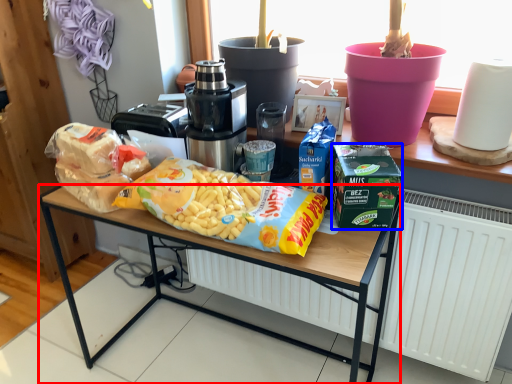
Question: Which object appears closest to the camera in this image, desk (highlighted by a red box) or lunch box (highlighted by a blue box)?

Choices:
 (A) desk
 (B) lunch box

Answer: (A)